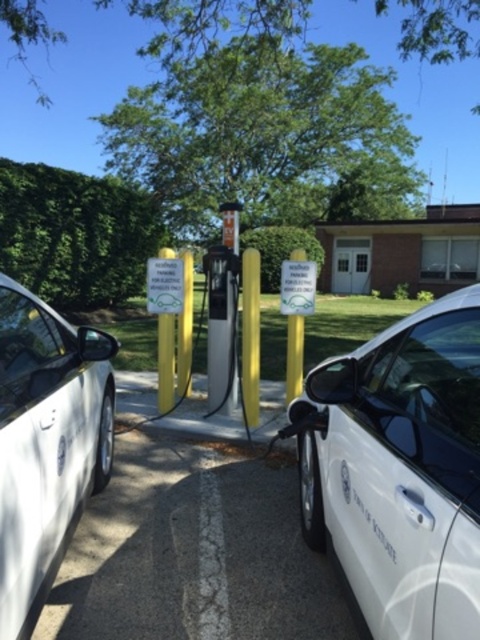
Question: Can you confirm if white glossy car at center is smaller than white matte car at left?

Choices:
 (A) no
 (B) yes

Answer: (B)

Question: Can you confirm if white glossy car at center is thinner than white matte car at left?

Choices:
 (A) no
 (B) yes

Answer: (A)

Question: Which point appears closest to the camera in this image?

Choices:
 (A) (39, 314)
 (B) (459, 419)

Answer: (B)

Question: In this image, where is white glossy car at center located relative to white matte car at left?

Choices:
 (A) left
 (B) right

Answer: (B)

Question: Which point is closer to the camera taking this photo?

Choices:
 (A) (32, 477)
 (B) (437, 424)

Answer: (B)